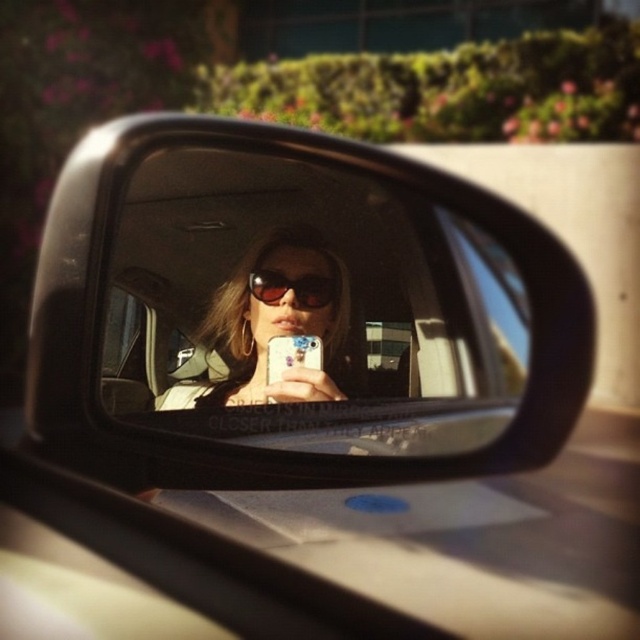
You are a photographer analyzing the car mirror reflection. You see two points marked in the mirror at coordinates point (280, 241) and point (298, 333). Based on their positions in the mirror, which point is closer to the camera lens?

Point (298, 333) is closer to the camera lens because it is in front of point (280, 241) according to their positions in the mirror.

You are trying to take a photo of the matte plastic mirror at center and sunglasses at center in the scene. Based on their sizes, which object would appear larger in the photo?

The matte plastic mirror at center appears larger in the photo because it is much taller than the sunglasses at center.

You are a photographer trying to capture the scene in the car side mirror. You notice the matte plastic mirror at center and the matte black sunglasses at center. Which object is positioned to the right side of the other?

The matte plastic mirror at center is to the right of matte black sunglasses at center.